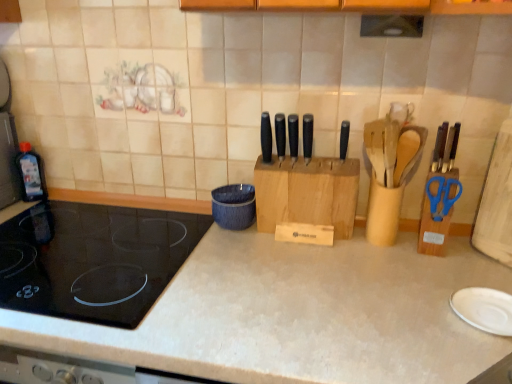
Where is `vacant area that is situated to the right of black plastic knife at center, which is counted as the fourth knife, starting from the right`? The width and height of the screenshot is (512, 384). vacant area that is situated to the right of black plastic knife at center, which is counted as the fourth knife, starting from the right is located at coordinates (326, 158).